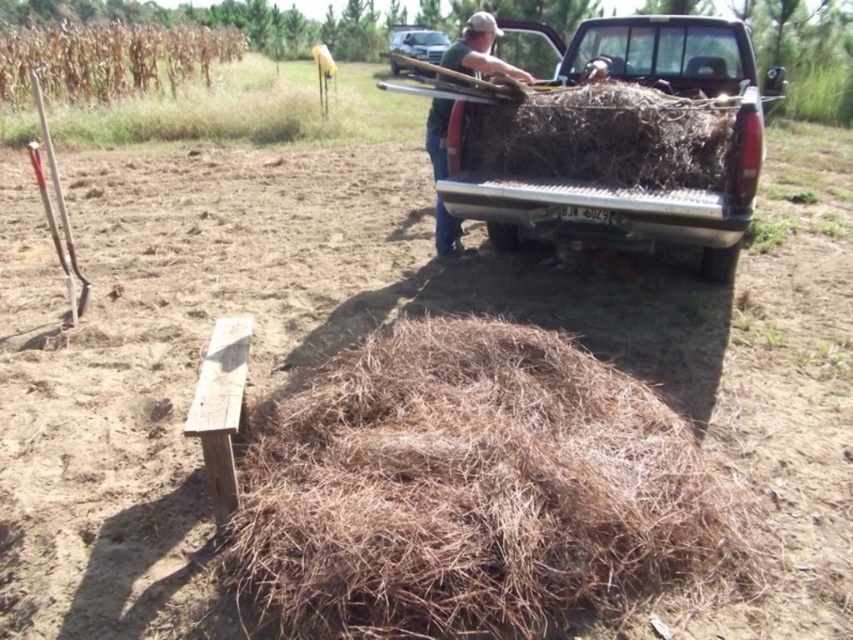
You are a farmer who needs to move the brown dry hay at center to the metallic silver truck at upper right. Based on their positions, which direction should you move the hay towards?

The brown dry hay at center is to the left of the metallic silver truck at upper right, so you should move the hay towards the right direction to reach the truck.

Looking at this image, you are standing at the edge of the field and want to place a 10 feet long fence between the brown dry hay at center and the green cotton shirt at upper center. Is there enough space between them to fit the fence?

The brown dry hay at center is 8.50 feet away from the green cotton shirt at upper center. Since the fence is 10 feet long, it is longer than the distance between them, so the fence cannot be placed between them.

Looking at this image, you are a farmer who needs to transport the brown dry hay at rear using the metallic silver truck at upper right. Can the truck carry the entire hay pile in one trip?

The metallic silver truck at upper right is bigger than brown dry hay at rear, so yes, the truck can carry the entire hay pile in one trip since it is larger in size.